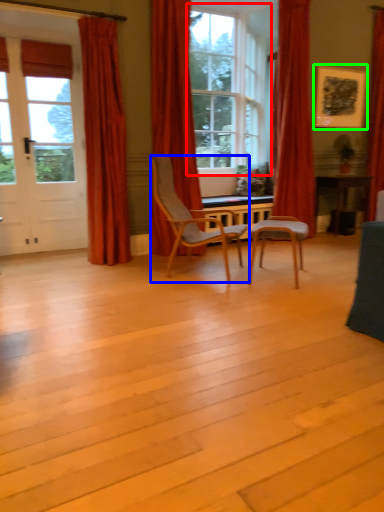
Question: Considering the real-world distances, which object is closest to window (highlighted by a red box)? chair (highlighted by a blue box) or picture frame (highlighted by a green box).

Choices:
 (A) chair
 (B) picture frame

Answer: (B)